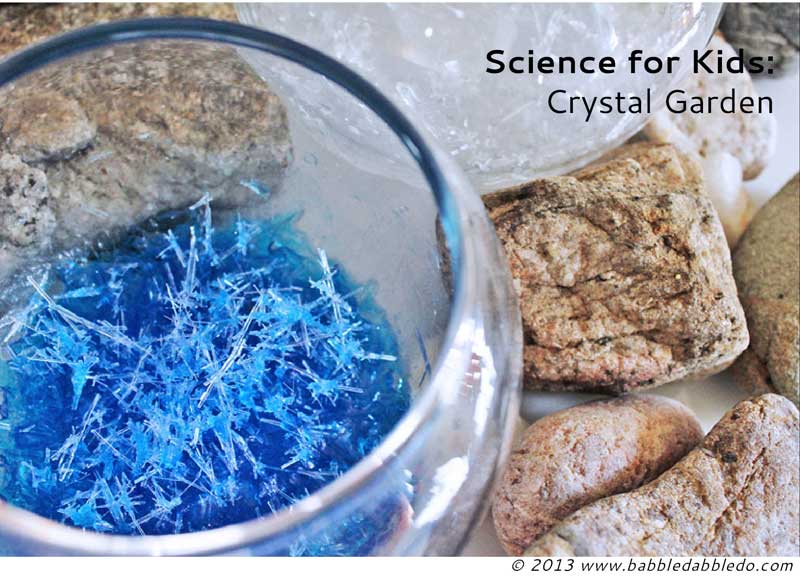
Locate an element on the screen. This screenshot has width=800, height=581. glass is located at coordinates (441, 466).